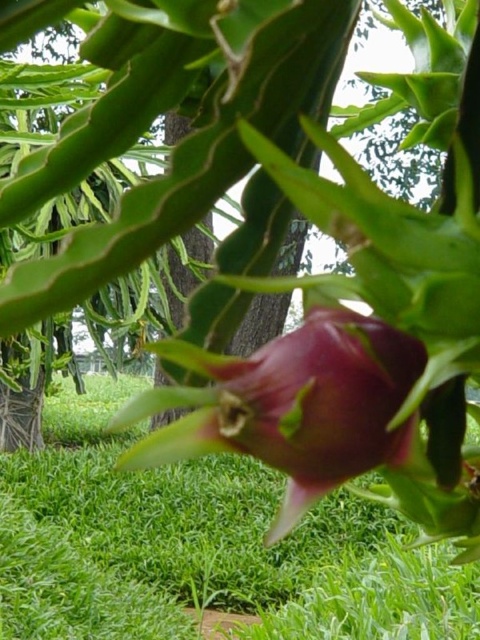
Question: Which point is closer to the camera taking this photo?

Choices:
 (A) (210, 477)
 (B) (319, 403)

Answer: (B)

Question: Is the position of green grass at center more distant than that of purple matte pitaya at center?

Choices:
 (A) yes
 (B) no

Answer: (A)

Question: Is green grass at center to the left of purple matte pitaya at center from the viewer's perspective?

Choices:
 (A) no
 (B) yes

Answer: (B)

Question: Can you confirm if green grass at center is positioned below purple matte pitaya at center?

Choices:
 (A) no
 (B) yes

Answer: (B)

Question: Among these points, which one is nearest to the camera?

Choices:
 (A) (94, 534)
 (B) (297, 368)

Answer: (B)